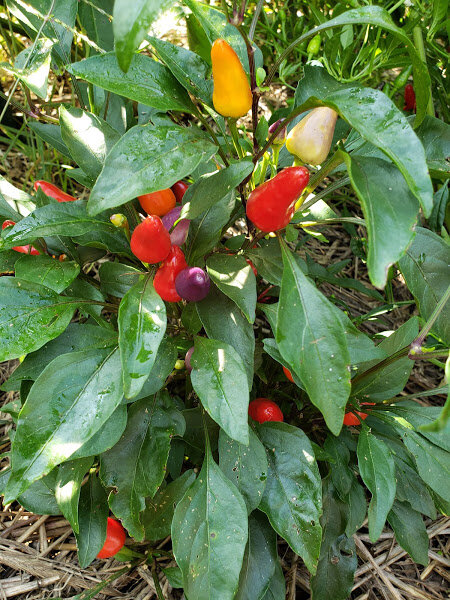
I want to click on floor, so click(x=64, y=537).